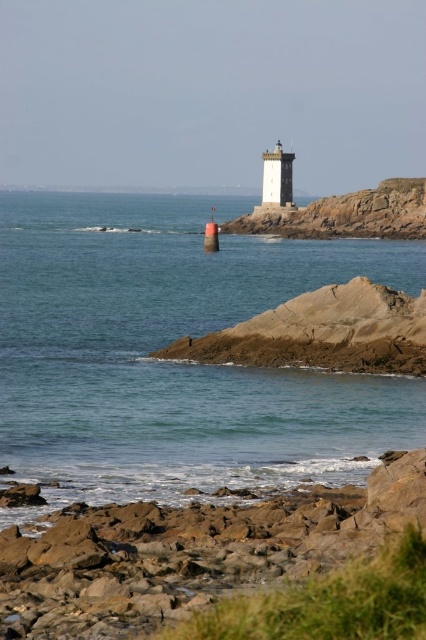
Question: Is clear blue water at center smaller than brown rock cliff at center?

Choices:
 (A) no
 (B) yes

Answer: (A)

Question: Considering the relative positions of brown rough rocks at lower left and brown rock cliff at center in the image provided, where is brown rough rocks at lower left located with respect to brown rock cliff at center?

Choices:
 (A) above
 (B) below

Answer: (B)

Question: Based on their relative distances, which object is nearer to the brown rock cliff at center?

Choices:
 (A) brown rough rocks at lower left
 (B) clear blue water at center

Answer: (B)

Question: Based on their relative distances, which object is nearer to the brown rock cliff at center?

Choices:
 (A) clear blue water at center
 (B) brown rough rocks at lower left

Answer: (A)

Question: Based on their relative distances, which object is nearer to the clear blue water at center?

Choices:
 (A) brown rock cliff at center
 (B) brown rough rocks at lower left

Answer: (A)

Question: Can you confirm if clear blue water at center is smaller than brown rock cliff at center?

Choices:
 (A) yes
 (B) no

Answer: (B)